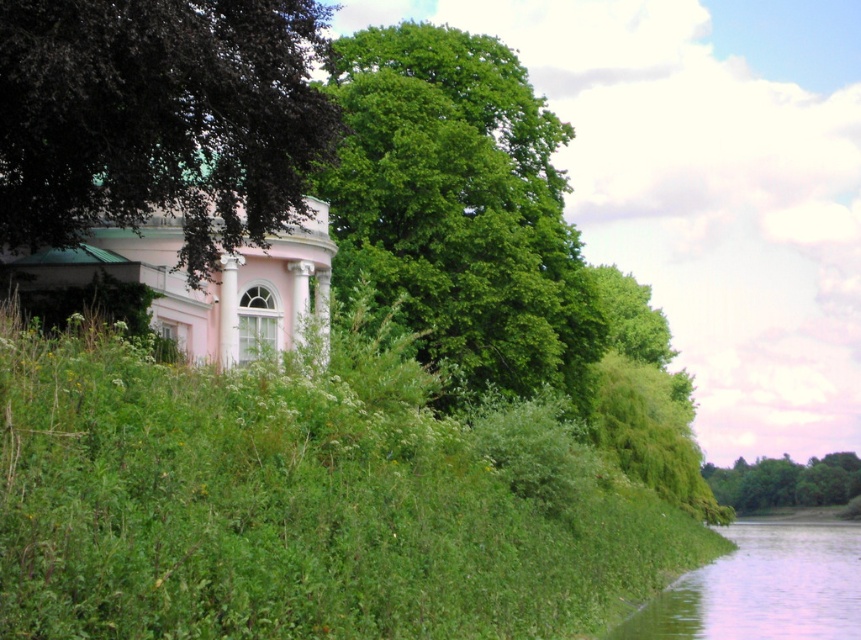
You are standing at the riverside and see two points marked in the image. The first point is at coordinates point (428,92) and the second is at point (762,500). Which point is closer to you?

Point (428,92) is in front of point (762,500), so it is closer to you.